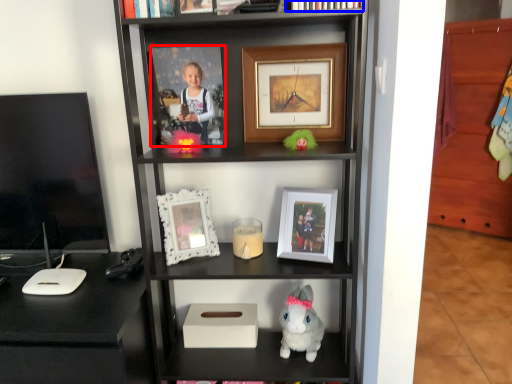
Question: Which point is closer to the camera, picture frame (highlighted by a red box) or book (highlighted by a blue box)?

Choices:
 (A) picture frame
 (B) book

Answer: (B)